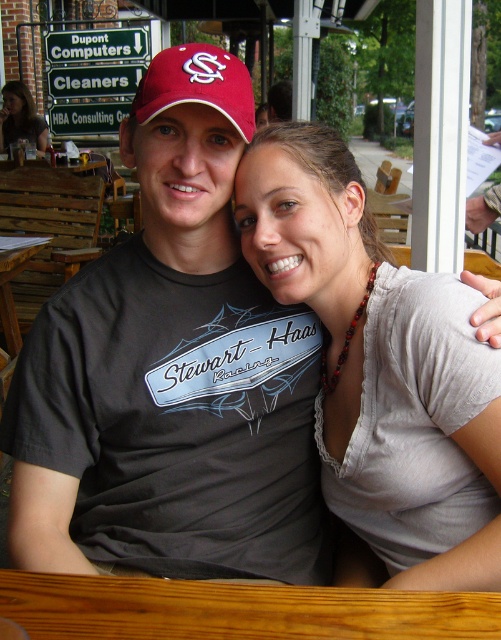
You are a photographer taking a picture of the matte gray shirt at center and the matte black hair at upper left. Which object should you adjust your camera to focus on first if you want to capture both in the same frame?

The matte black hair at upper left should be focused on first since it is positioned to the left of the matte gray shirt at center, allowing the camera to capture both objects in the frame by adjusting from left to right.

You are standing at the entrance of the outdoor cafe and want to find the matte gray shirt at center. According to the coordinates provided, in which direction should you look relative to the center of the image?

The matte gray shirt at center is located at point coordinates 0.556 on the x axis and 0.750 on the y axis. Since the center of the image is at 0.5 on both axes, the x coordinate is slightly to the right and the y coordinate is above the center. Therefore, you should look slightly to the right and upwards from the center of the image to locate the matte gray shirt at center.